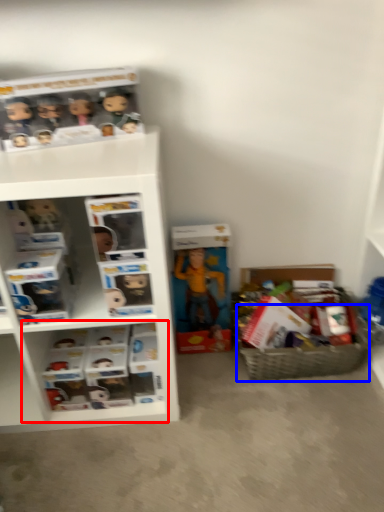
Question: Among these objects, which one is nearest to the camera, cabinet (highlighted by a red box) or basket (highlighted by a blue box)?

Choices:
 (A) cabinet
 (B) basket

Answer: (A)